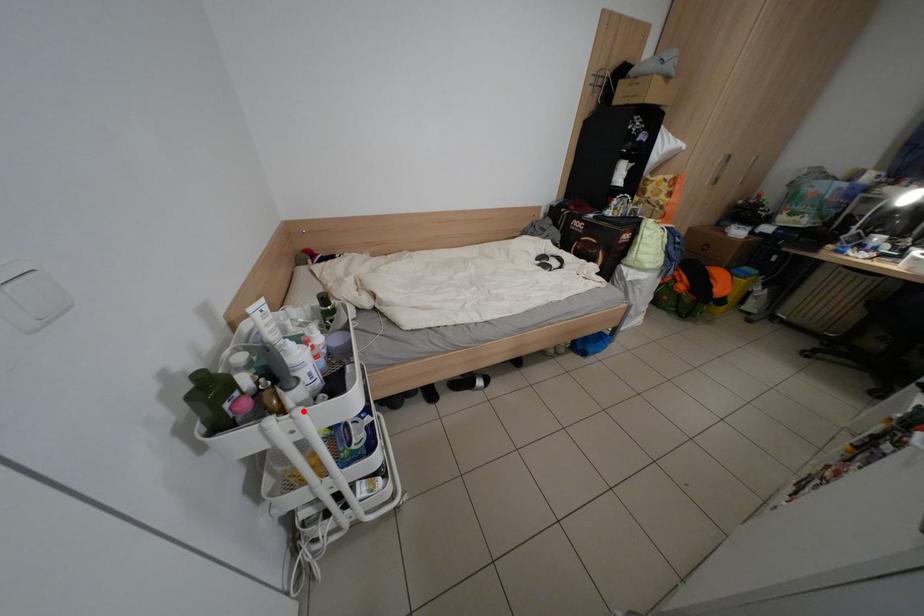
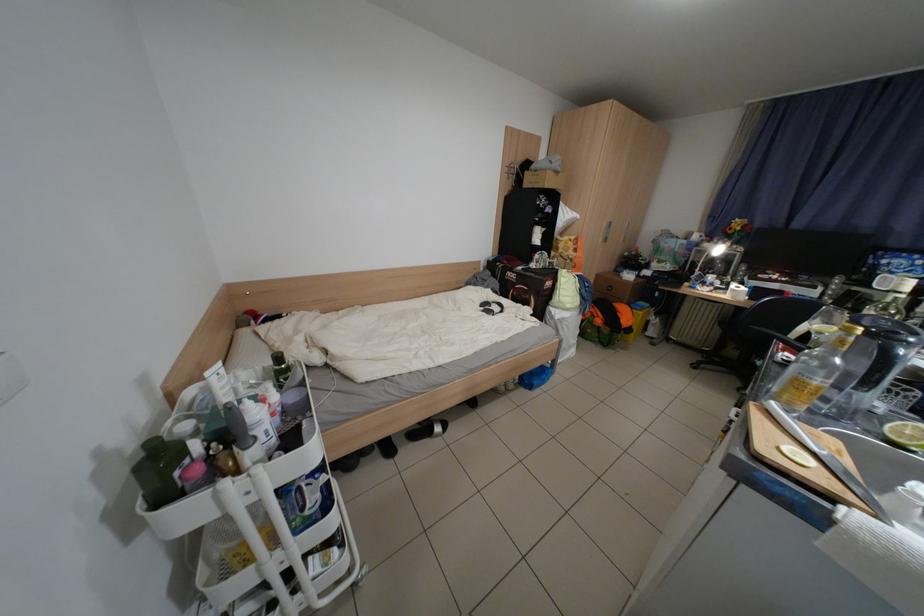
In the second image, find the point that corresponds to the highlighted location in the first image.

(261, 469)